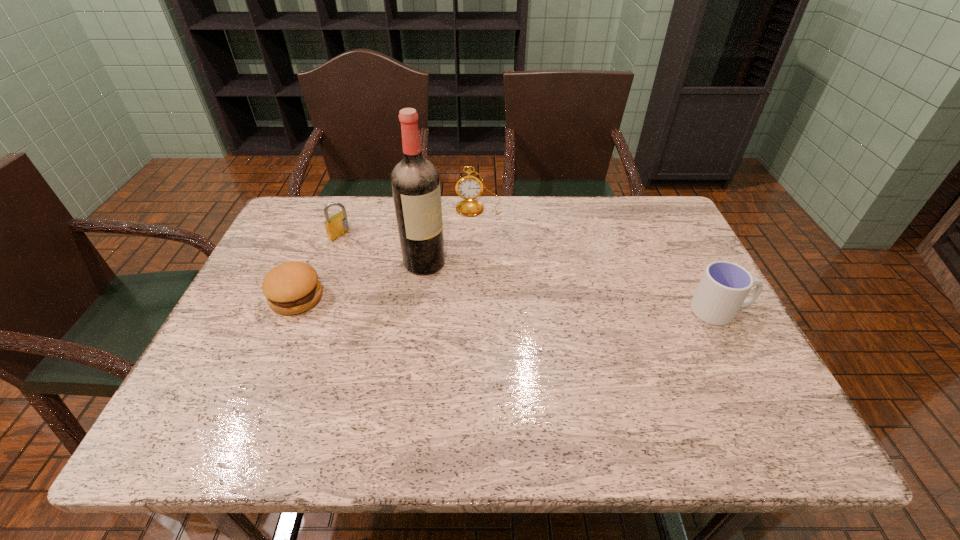
You are a GUI agent. You are given a task and a screenshot of the screen. Output one action in this format:
    pyautogui.click(x=<x>, y=<y>)
    Task: Click on the free space that is in between the shortest object and the padlock
    This screenshot has height=540, width=960.
    Given the screenshot: What is the action you would take?
    pyautogui.click(x=319, y=266)

Identify the location of free space between the fourth object from left to right and the third farthest object. (451, 234).

Find the location of a particular element. Image resolution: width=960 pixels, height=540 pixels. free point between the hamburger and the second object from right to left is located at coordinates (388, 252).

Locate an element on the screen. vacant region between the shortest object and the fourth nearest object is located at coordinates (319, 266).

Find the location of a particular element. free area in between the tallest object and the hamburger is located at coordinates (360, 280).

Find the location of a particular element. free spot between the fourth nearest object and the tallest object is located at coordinates (383, 248).

Locate an element on the screen. This screenshot has height=540, width=960. vacant region between the third object from left to right and the cup is located at coordinates (572, 287).

Locate an element on the screen. The image size is (960, 540). blank region between the pocket watch and the third farthest object is located at coordinates (451, 234).

You are a GUI agent. You are given a task and a screenshot of the screen. Output one action in this format:
    pyautogui.click(x=<x>, y=<y>)
    Task: Click on the free space between the farthest object and the hamburger
    
    Given the screenshot: What is the action you would take?
    pyautogui.click(x=388, y=252)

Where is `the fourth closest object to the third object from right to left`? The height and width of the screenshot is (540, 960). the fourth closest object to the third object from right to left is located at coordinates (724, 286).